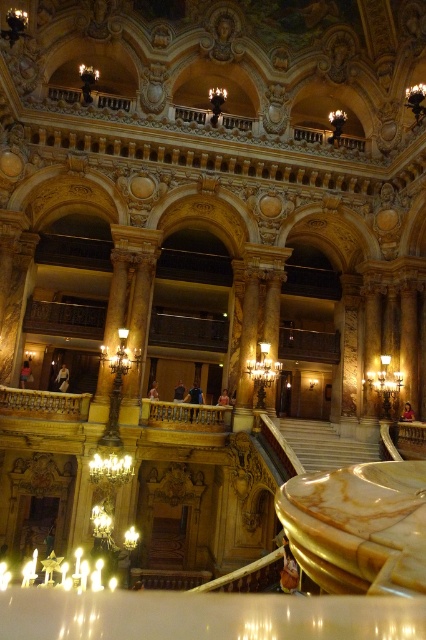
Consider the image. Is white marble stairs at center smaller than gold ornate railing at upper center?

Correct, white marble stairs at center occupies less space than gold ornate railing at upper center.

Between white marble stairs at center and gold ornate railing at upper center, which one appears on the left side from the viewer's perspective?

gold ornate railing at upper center

The image size is (426, 640). I want to click on white marble stairs at center, so click(x=324, y=444).